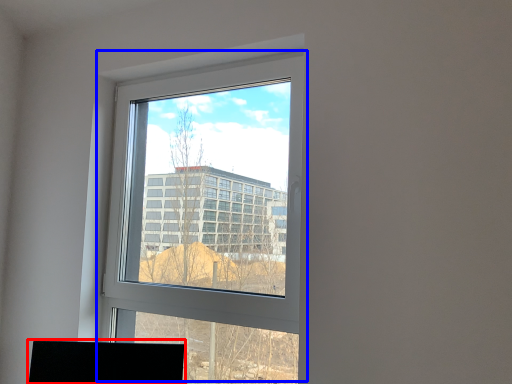
Question: Which point is further to the camera, desktop (highlighted by a red box) or window (highlighted by a blue box)?

Choices:
 (A) desktop
 (B) window

Answer: (A)